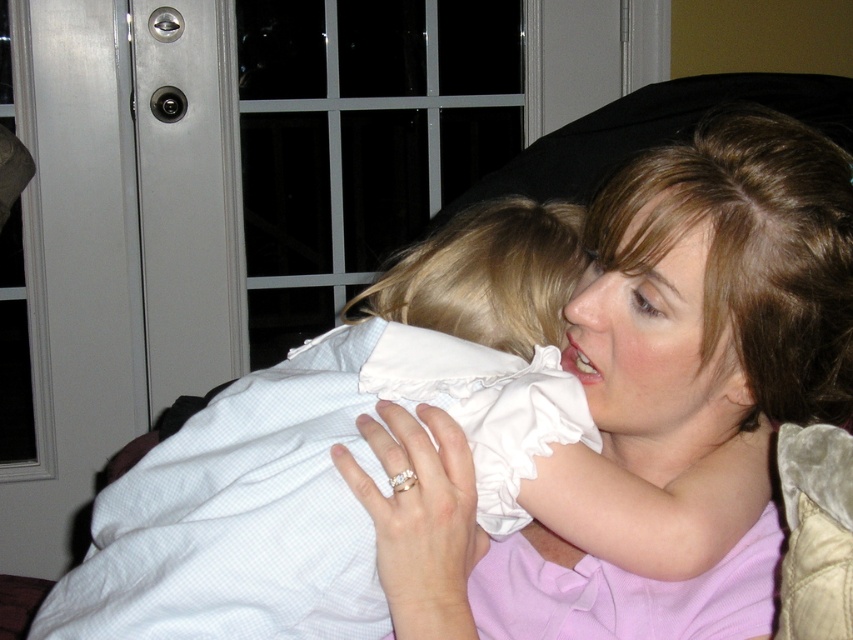
You are a photographer setting up a shoot in this scene. You need to position a backdrop behind the two subjects. The backdrop is 1.8 meters tall. Considering the height of the matte white shirt at center and the white cotton dress at center, will the backdrop cover both items adequately?

The matte white shirt at center is taller than the white cotton dress at center. Since the backdrop is 1.8 meters tall, it will cover both items adequately as it exceeds their height.

You are standing in the room and want to touch both points on the door. Which point should you reach for first, the point at coordinate (463, 548) or the point at coordinate (193, 620)?

You should reach for the point at coordinate (193, 620) first because it is closer to you than the point at coordinate (463, 548), which is further away.

You are a photographer trying to capture a candid shot of the two subjects in the scene. You want to ensure that both the matte white shirt at center and the white cotton dress at center are in focus simultaneously. Given that your camera has a depth of field that can cover 4 inches, will you be able to achieve this without adjusting your settings?

The distance between the matte white shirt at center and the white cotton dress at center is 3.83 inches, which is within the 4 inch depth of field range. Therefore, you can capture both in focus without adjusting your camera settings.